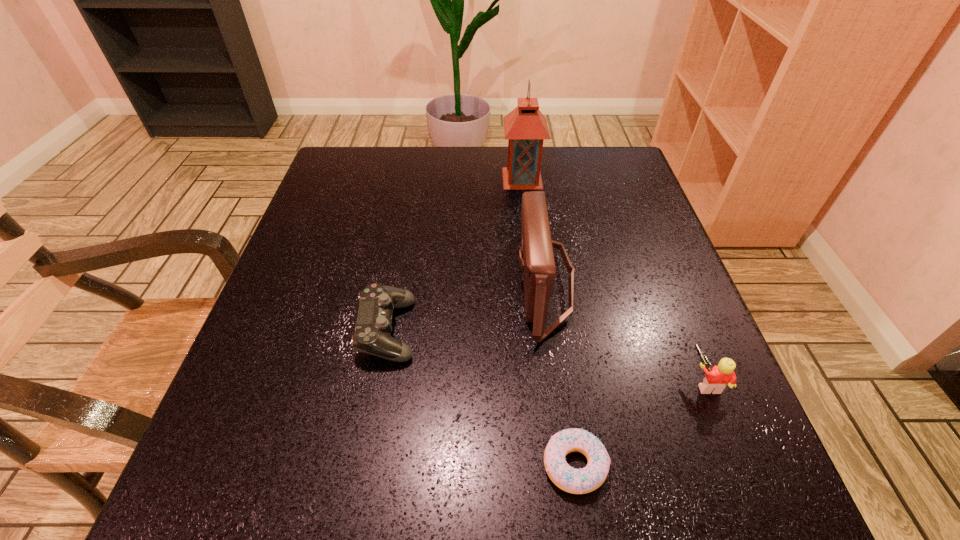
Find the location of a particular element. The image size is (960, 540). vacant space located on the front flap of the second tallest object is located at coordinates (350, 284).

At what (x,y) coordinates should I click in order to perform the action: click on free region located on the front flap of the second tallest object. Please return your answer as a coordinate pair (x, y). Image resolution: width=960 pixels, height=540 pixels. Looking at the image, I should click on (477, 284).

Locate an element on the screen. This screenshot has width=960, height=540. blank area located on the front flap of the second tallest object is located at coordinates (316, 284).

Identify the location of vacant area situated in front of the rightmost object with the accessory visible. The height and width of the screenshot is (540, 960). (469, 382).

Image resolution: width=960 pixels, height=540 pixels. Find the location of `vacant space situated in front of the rightmost object with the accessory visible`. vacant space situated in front of the rightmost object with the accessory visible is located at coordinates (549, 382).

At what (x,y) coordinates should I click in order to perform the action: click on vacant area located in front of the rightmost object with the accessory visible. Please return your answer as a coordinate pair (x, y). The width and height of the screenshot is (960, 540). Looking at the image, I should click on (598, 382).

You are a GUI agent. You are given a task and a screenshot of the screen. Output one action in this format:
    pyautogui.click(x=<x>, y=<y>)
    Task: Click on the free region located on the left of the leftmost object
    
    Given the screenshot: What is the action you would take?
    pyautogui.click(x=270, y=330)

At what (x,y) coordinates should I click in order to perform the action: click on vacant space located on the left of the doughnut. Please return your answer as a coordinate pair (x, y). Looking at the image, I should click on (444, 465).

You are a GUI agent. You are given a task and a screenshot of the screen. Output one action in this format:
    pyautogui.click(x=<x>, y=<y>)
    Task: Click on the object that is at the far edge
    
    Given the screenshot: What is the action you would take?
    pyautogui.click(x=525, y=127)

Identify the location of object that is positioned at the near edge. This screenshot has height=540, width=960. (576, 481).